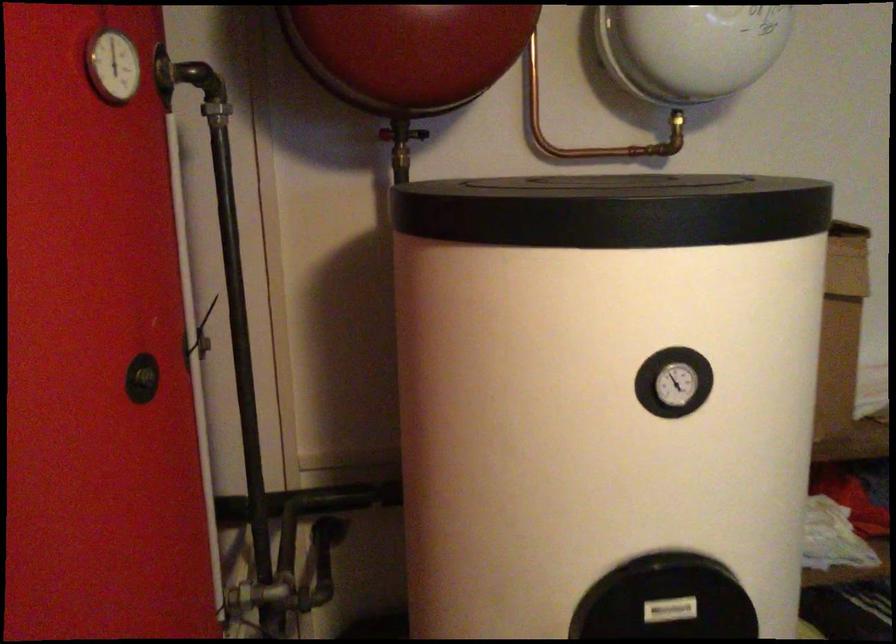
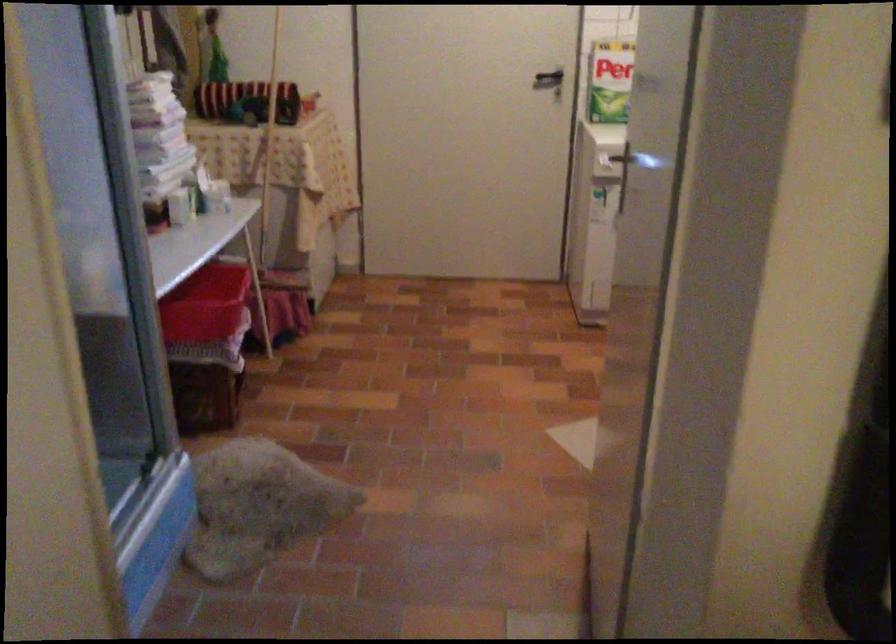
The first image is from the beginning of the video and the second image is from the end. How did the camera likely rotate when shooting the video?

The rotation direction of the camera is left-down.